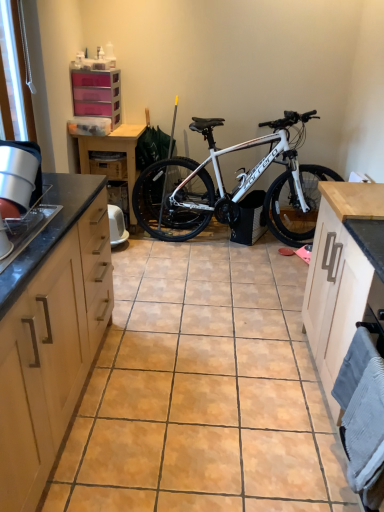
Where is `light wood cabinetry at left, which ranks as the 1th cabinetry in bottom-to-top order`? Image resolution: width=384 pixels, height=512 pixels. light wood cabinetry at left, which ranks as the 1th cabinetry in bottom-to-top order is located at coordinates click(48, 337).

This screenshot has width=384, height=512. Find the location of `pink plastic drawers at upper left, placed as the first cabinetry when sorted from left to right`. pink plastic drawers at upper left, placed as the first cabinetry when sorted from left to right is located at coordinates (97, 94).

This screenshot has width=384, height=512. Identify the location of white metallic bicycle at center. (233, 189).

Find the location of a particular element. This screenshot has width=384, height=512. wooden table at center is located at coordinates (112, 151).

From a real-world perspective, is wooden drawer at center on top of light wood cabinetry at left, which is counted as the 1th cabinetry, starting from the front?

Yes, from a real-world perspective, wooden drawer at center is on top of light wood cabinetry at left, which is counted as the 1th cabinetry, starting from the front.

Does wooden drawer at center come in front of light wood cabinetry at left, the 3th cabinetry from the top?

That is False.

Is wooden drawer at center wider or thinner than light wood cabinetry at left, which is counted as the 1th cabinetry, starting from the front?

wooden drawer at center is thinner than light wood cabinetry at left, which is counted as the 1th cabinetry, starting from the front.

Is light wood cabinetry at left, positioned as the third cabinetry in back-to-front order, facing towards wooden table at center?

No.

From the image's perspective, relative to wooden table at center, is light wood cabinetry at left, which ranks as the 1th cabinetry in bottom-to-top order, above or below?

light wood cabinetry at left, which ranks as the 1th cabinetry in bottom-to-top order, is below wooden table at center.

Is light wood cabinetry at left, the second cabinetry from the left, positioned in front of wooden table at center?

Yes, it is.

Is light wood cabinetry at left, positioned as the third cabinetry in back-to-front order, smaller than wooden table at center?

No.

Considering the relative positions of white metallic bicycle at center and wooden drawer at center in the image provided, is white metallic bicycle at center behind wooden drawer at center?

No, it is not.

From the image's perspective, is white metallic bicycle at center positioned above or below wooden drawer at center?

white metallic bicycle at center is below wooden drawer at center.

Which of these two, white metallic bicycle at center or wooden drawer at center, is wider?

Wider between the two is wooden drawer at center.

Are light wood cabinet at right, marked as the second cabinetry in a bottom-to-top arrangement, and white metallic bicycle at center located far from each other?

Absolutely, light wood cabinet at right, marked as the second cabinetry in a bottom-to-top arrangement, is distant from white metallic bicycle at center.

Is light wood cabinet at right, positioned as the 1th cabinetry in right-to-left order, at the left side of white metallic bicycle at center?

No.

Considering the points (353, 254) and (318, 195), which point is in front, point (353, 254) or point (318, 195)?

The point (353, 254) is in front.

From a real-world perspective, which is physically below, light wood cabinet at right, the 2th cabinetry positioned from the top, or pink plastic drawers at upper left, the 3th cabinetry in the right-to-left sequence?

light wood cabinet at right, the 2th cabinetry positioned from the top, from a real-world perspective.

Is light wood cabinet at right, which is the second cabinetry from back to front, shorter than pink plastic drawers at upper left, the 3th cabinetry in the right-to-left sequence?

No, light wood cabinet at right, which is the second cabinetry from back to front, is not shorter than pink plastic drawers at upper left, the 3th cabinetry in the right-to-left sequence.

Is point (307, 307) closer or farther from the camera than point (106, 86)?

Point (307, 307).

Considering the relative sizes of pink plastic drawers at upper left, the 1th cabinetry when ordered from top to bottom, and white metallic bicycle at center in the image provided, is pink plastic drawers at upper left, the 1th cabinetry when ordered from top to bottom, taller than white metallic bicycle at center?

Incorrect, the height of pink plastic drawers at upper left, the 1th cabinetry when ordered from top to bottom, is not larger of that of white metallic bicycle at center.

Is there a large distance between pink plastic drawers at upper left, placed as the first cabinetry when sorted from left to right, and white metallic bicycle at center?

Yes.

Is pink plastic drawers at upper left, the 1th cabinetry from the back, situated inside white metallic bicycle at center or outside?

pink plastic drawers at upper left, the 1th cabinetry from the back, is located beyond the bounds of white metallic bicycle at center.

Find the location of a particular element. This screenshot has height=512, width=384. bicycle that is below the pink plastic drawers at upper left, placed as the first cabinetry when sorted from left to right (from the image's perspective) is located at coordinates (233, 189).

Image resolution: width=384 pixels, height=512 pixels. In order to click on table located below the pink plastic drawers at upper left, the 3th cabinetry in the right-to-left sequence (from the image's perspective) in this screenshot , I will do `click(112, 151)`.

Is wooden table at center beside pink plastic drawers at upper left, the 3th cabinetry positioned from the front?

No, wooden table at center is not making contact with pink plastic drawers at upper left, the 3th cabinetry positioned from the front.

Based on the photo, considering the sizes of wooden table at center and pink plastic drawers at upper left, the 3th cabinetry positioned from the front, in the image, is wooden table at center wider or thinner than pink plastic drawers at upper left, the 3th cabinetry positioned from the front,?

Clearly, wooden table at center has more width compared to pink plastic drawers at upper left, the 3th cabinetry positioned from the front.

Between wooden table at center and pink plastic drawers at upper left, the 3th cabinetry when ordered from bottom to top, which one has smaller size?

With smaller size is pink plastic drawers at upper left, the 3th cabinetry when ordered from bottom to top.

Locate an element on the screen. The width and height of the screenshot is (384, 512). the 1st cabinetry below the wooden drawer at center (from a real-world perspective) is located at coordinates (48, 337).

The image size is (384, 512). What are the coordinates of `table above the light wood cabinetry at left, positioned as the third cabinetry in back-to-front order (from the image's perspective)` in the screenshot? It's located at tap(112, 151).

Looking at the image, which one is located closer to white metallic bicycle at center, pink plastic drawers at upper left, the 1th cabinetry when ordered from top to bottom, or light wood cabinetry at left, the second cabinetry from the left?

Among the two, pink plastic drawers at upper left, the 1th cabinetry when ordered from top to bottom, is located nearer to white metallic bicycle at center.

Considering their positions, is light wood cabinetry at left, the 3th cabinetry from the top, positioned further to wooden drawer at center than wooden table at center?

light wood cabinetry at left, the 3th cabinetry from the top, is positioned further to the anchor wooden drawer at center.

From the image, which object appears to be farther from pink plastic drawers at upper left, the 1th cabinetry when ordered from top to bottom, white metallic bicycle at center or light wood cabinetry at left, which ranks as the 1th cabinetry in bottom-to-top order?

light wood cabinetry at left, which ranks as the 1th cabinetry in bottom-to-top order, is positioned further to the anchor pink plastic drawers at upper left, the 1th cabinetry when ordered from top to bottom.

In the scene shown: Which object lies further to the anchor point pink plastic drawers at upper left, placed as the first cabinetry when sorted from left to right, light wood cabinetry at left, which is counted as the 1th cabinetry, starting from the front, or white metallic bicycle at center?

The object further to pink plastic drawers at upper left, placed as the first cabinetry when sorted from left to right, is light wood cabinetry at left, which is counted as the 1th cabinetry, starting from the front.

Which object lies further to the anchor point light wood cabinet at right, which appears as the second cabinetry when viewed from the front, light wood cabinetry at left, the second cabinetry from the left, or pink plastic drawers at upper left, the 3th cabinetry when ordered from bottom to top?

Among the two, pink plastic drawers at upper left, the 3th cabinetry when ordered from bottom to top, is located further to light wood cabinet at right, which appears as the second cabinetry when viewed from the front.

Estimate the real-world distances between objects in this image. Which object is closer to light wood cabinetry at left, the 3th cabinetry from the top, light wood cabinet at right, which appears as the second cabinetry when viewed from the front, or white metallic bicycle at center?

Based on the image, light wood cabinet at right, which appears as the second cabinetry when viewed from the front, appears to be nearer to light wood cabinetry at left, the 3th cabinetry from the top.

Looking at the image, which one is located closer to light wood cabinetry at left, the second cabinetry viewed from the right, wooden table at center or light wood cabinet at right, positioned as the 1th cabinetry in right-to-left order?

light wood cabinet at right, positioned as the 1th cabinetry in right-to-left order, lies closer to light wood cabinetry at left, the second cabinetry viewed from the right, than the other object.

Which object lies further to the anchor point white metallic bicycle at center, pink plastic drawers at upper left, the 1th cabinetry when ordered from top to bottom, or wooden table at center?

Among the two, pink plastic drawers at upper left, the 1th cabinetry when ordered from top to bottom, is located further to white metallic bicycle at center.

Identify the location of bicycle located between light wood cabinet at right, the 2th cabinetry positioned from the top, and wooden drawer at center in the depth direction. The height and width of the screenshot is (512, 384). (233, 189).

Image resolution: width=384 pixels, height=512 pixels. Identify the location of cabinetry positioned between light wood cabinet at right, which is the second cabinetry from back to front, and wooden table at center from near to far. (97, 94).

You are a GUI agent. You are given a task and a screenshot of the screen. Output one action in this format:
    pyautogui.click(x=<x>, y=<y>)
    Task: Click on the table positioned between light wood cabinet at right, positioned as the 1th cabinetry in right-to-left order, and white metallic bicycle at center from near to far
    
    Given the screenshot: What is the action you would take?
    pyautogui.click(x=112, y=151)

Where is `cabinetry between light wood cabinet at right, marked as the second cabinetry in a bottom-to-top arrangement, and wooden drawer at center, along the z-axis`? The image size is (384, 512). cabinetry between light wood cabinet at right, marked as the second cabinetry in a bottom-to-top arrangement, and wooden drawer at center, along the z-axis is located at coordinates (97, 94).